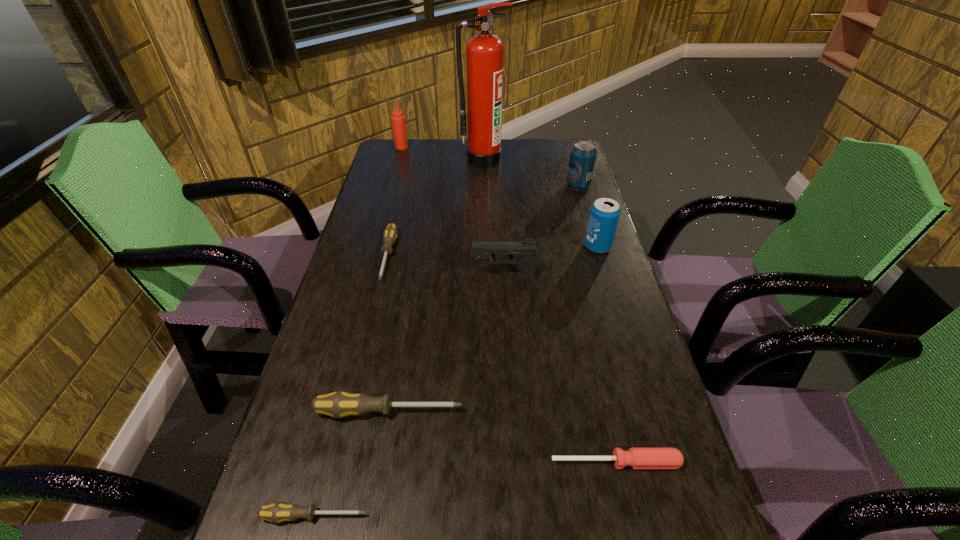
Identify the location of empty space between the nearer soda can and the farthest object. The width and height of the screenshot is (960, 540). (499, 197).

This screenshot has height=540, width=960. Find the location of `vacant space that is in between the third farthest object and the pistol`. vacant space that is in between the third farthest object and the pistol is located at coordinates (540, 231).

The image size is (960, 540). Find the location of `free space between the nearest object and the fire extinguisher`. free space between the nearest object and the fire extinguisher is located at coordinates (398, 338).

You are a GUI agent. You are given a task and a screenshot of the screen. Output one action in this format:
    pyautogui.click(x=<x>, y=<y>)
    Task: Click on the vacant space that's between the seventh nearest object and the nearest gray screwdriver
    The image size is (960, 540).
    Given the screenshot: What is the action you would take?
    pyautogui.click(x=446, y=350)

In order to click on free area in between the farthest object and the nearer soda can in this screenshot , I will do `click(499, 197)`.

Identify which object is the fifth nearest to the farthest object. Please provide its 2D coordinates. Your answer should be formatted as a tuple, i.e. [(x, y)], where the tuple contains the x and y coordinates of a point satisfying the conditions above.

[(604, 215)]

This screenshot has height=540, width=960. I want to click on object that can be found as the sixth closest to the Tabasco sauce, so click(339, 404).

At what (x,y) coordinates should I click in order to perform the action: click on screwdriver that stands as the closest to the biggest gray screwdriver. Please return your answer as a coordinate pair (x, y). Looking at the image, I should click on (277, 512).

Locate an element on the screen. Image resolution: width=960 pixels, height=540 pixels. screwdriver that is the third nearest to the farthest screwdriver is located at coordinates (638, 458).

Where is `the closest gray screwdriver to the second farthest gray screwdriver`? the closest gray screwdriver to the second farthest gray screwdriver is located at coordinates (277, 512).